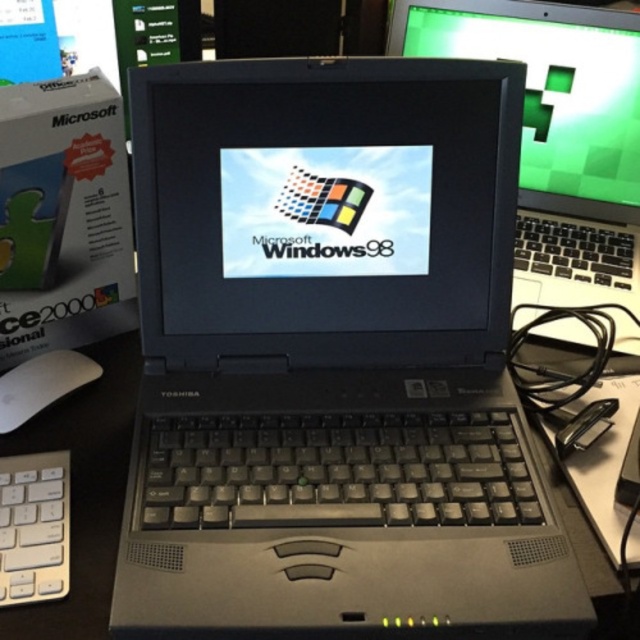
You are setting up a new workspace and have a black plastic table at center and a white matte mouse at lower left. Which object is wider?

The black plastic table at center is wider than the white matte mouse at lower left according to the description.

From the picture: You are a delivery person who needs to place a new laptop on the desk. The new laptop is 12 inches wide. The slate gray plastic laptop at center and the white plastic keyboard at lower left are already on the desk. Is there enough space between them to place the new laptop?

The distance between the slate gray plastic laptop at center and the white plastic keyboard at lower left is 12.27 inches. Since the new laptop is 12 inches wide, there is enough space between them to place the new laptop.

You are standing in front of the Toshiba laptop displaying the Windows 98 logo. There is a point at coordinates (332, 360). What object is located at that point?

The slate gray plastic laptop at center is located at point (332, 360).